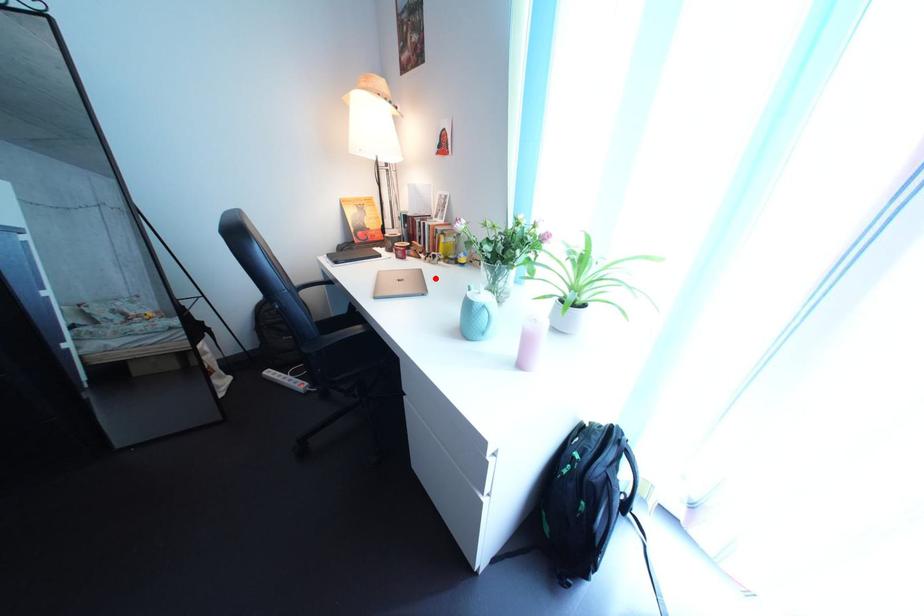
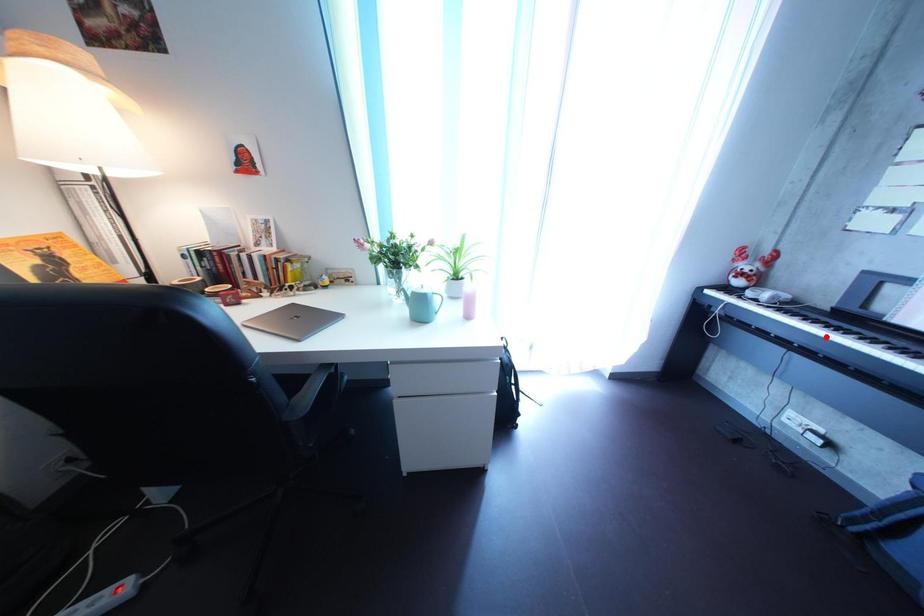
I am providing you with two images of the same scene from different viewpoints. A red point is marked on the first image and another point is marked on the second image. Are the points marked in image1 and image2 representing the same 3D position?

No